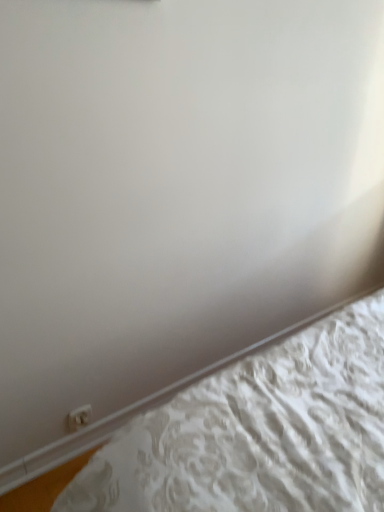
Question: Is white textured mattress at lower right bigger or smaller than white plastic electric outlet at lower left?

Choices:
 (A) big
 (B) small

Answer: (A)

Question: Choose the correct answer: Is white textured mattress at lower right inside white plastic electric outlet at lower left or outside it?

Choices:
 (A) inside
 (B) outside

Answer: (B)

Question: Looking at their shapes, would you say white textured mattress at lower right is wider or thinner than white plastic electric outlet at lower left?

Choices:
 (A) wide
 (B) thin

Answer: (A)

Question: Would you say white plastic electric outlet at lower left is to the left or to the right of white textured mattress at lower right in the picture?

Choices:
 (A) right
 (B) left

Answer: (B)

Question: In terms of width, does white plastic electric outlet at lower left look wider or thinner when compared to white textured mattress at lower right?

Choices:
 (A) thin
 (B) wide

Answer: (A)

Question: Is white plastic electric outlet at lower left taller or shorter than white textured mattress at lower right?

Choices:
 (A) tall
 (B) short

Answer: (A)

Question: Is white plastic electric outlet at lower left in front of or behind white textured mattress at lower right in the image?

Choices:
 (A) front
 (B) behind

Answer: (B)